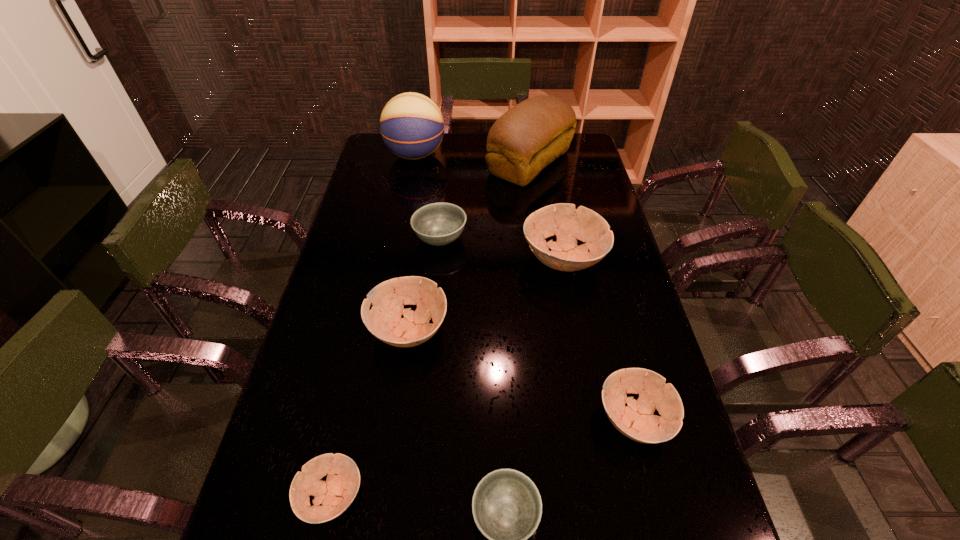
Find the location of a particular element. the nearest brown bowl is located at coordinates (336, 494).

The height and width of the screenshot is (540, 960). Find the location of `vacant region located on the patterned surface of the blue basketball`. vacant region located on the patterned surface of the blue basketball is located at coordinates (542, 156).

Where is `free location located 0.060m on the right of the bread`? free location located 0.060m on the right of the bread is located at coordinates (589, 163).

Image resolution: width=960 pixels, height=540 pixels. Identify the location of vacant space situated on the back of the farthest brown bowl. (546, 171).

Identify the location of vacant space located 0.220m on the front of the fifth farthest object. coord(392,450).

This screenshot has width=960, height=540. Find the location of `vacant space located on the front of the bigger gray bowl`. vacant space located on the front of the bigger gray bowl is located at coordinates (435, 294).

You are a GUI agent. You are given a task and a screenshot of the screen. Output one action in this format:
    pyautogui.click(x=<x>, y=<y>)
    Task: Click on the vacant space situated on the back of the third farthest brown bowl
    
    Given the screenshot: What is the action you would take?
    pyautogui.click(x=600, y=288)

I want to click on vacant area situated on the right of the smallest brown bowl, so click(540, 497).

The image size is (960, 540). In order to click on basketball located in the far edge section of the desktop in this screenshot , I will do `click(412, 127)`.

This screenshot has height=540, width=960. What are the coordinates of `bread that is positioned at the far edge` in the screenshot? It's located at 534,133.